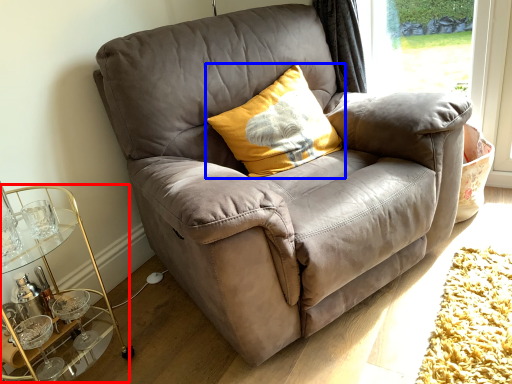
Question: Among these objects, which one is farthest to the camera, cocktail table (highlighted by a red box) or pillow (highlighted by a blue box)?

Choices:
 (A) cocktail table
 (B) pillow

Answer: (B)